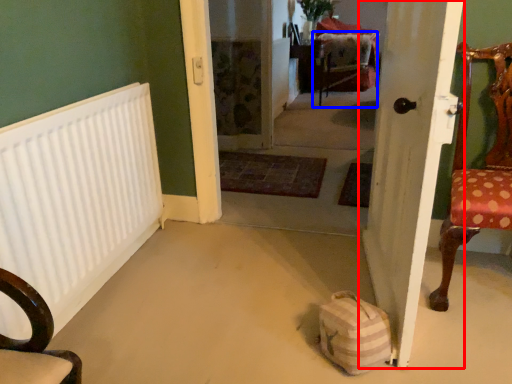
Question: Among these objects, which one is nearest to the camera, door (highlighted by a red box) or armchair (highlighted by a blue box)?

Choices:
 (A) door
 (B) armchair

Answer: (A)